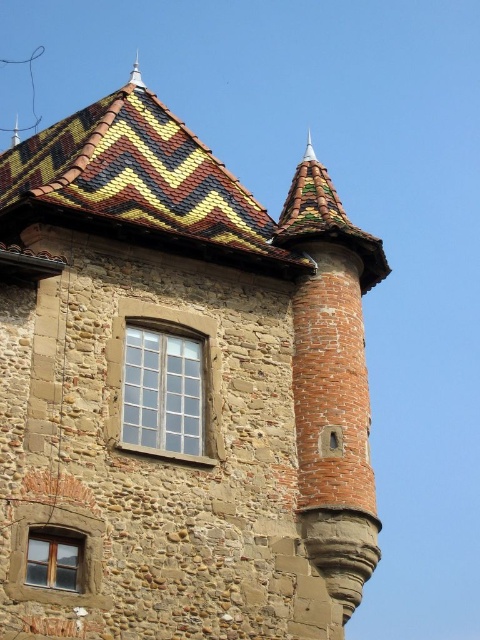
Question: Among these objects, which one is farthest from the camera?

Choices:
 (A) multicolored tiled roof at upper center
 (B) wooden window at lower left
 (C) clear glass window at center

Answer: (A)

Question: In this image, where is multicolored tiled roof at upper center located relative to wooden window at lower left?

Choices:
 (A) below
 (B) above

Answer: (B)

Question: Which point is closer to the camera?

Choices:
 (A) click(x=31, y=180)
 (B) click(x=59, y=584)
 (C) click(x=141, y=436)

Answer: (B)

Question: Is clear glass window at center to the right of wooden window at lower left from the viewer's perspective?

Choices:
 (A) no
 (B) yes

Answer: (B)

Question: In this image, where is clear glass window at center located relative to wooden window at lower left?

Choices:
 (A) left
 (B) right

Answer: (B)

Question: Which of these objects is positioned farthest from the multicolored tiled roof at upper center?

Choices:
 (A) wooden window at lower left
 (B) clear glass window at center

Answer: (A)